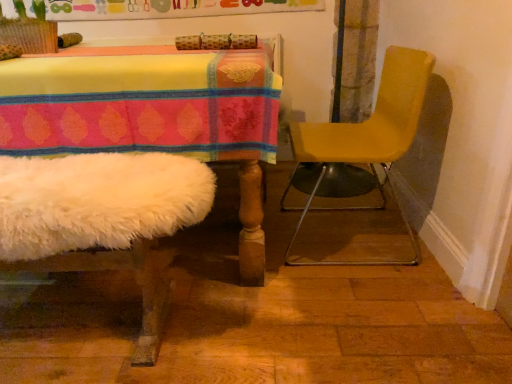
Where is `blank space to the left of matte yellow chair at right`? The width and height of the screenshot is (512, 384). blank space to the left of matte yellow chair at right is located at coordinates (223, 262).